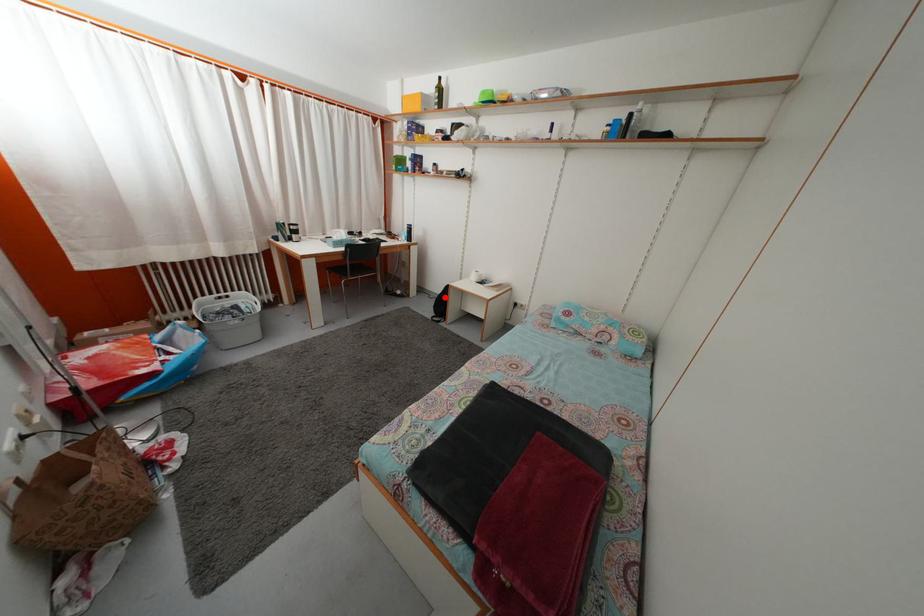
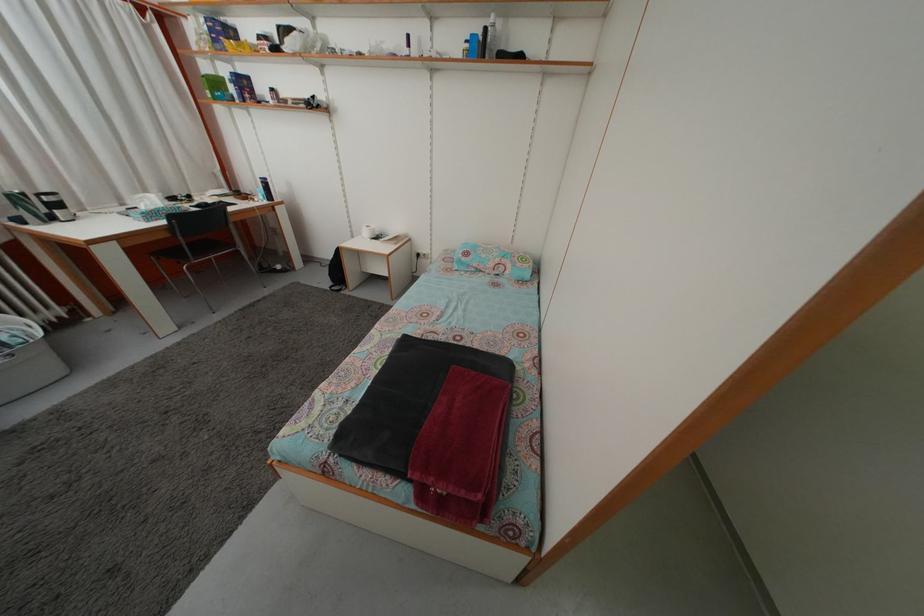
Find the pixel in the second image that matches the highlighted location in the first image.

(335, 262)